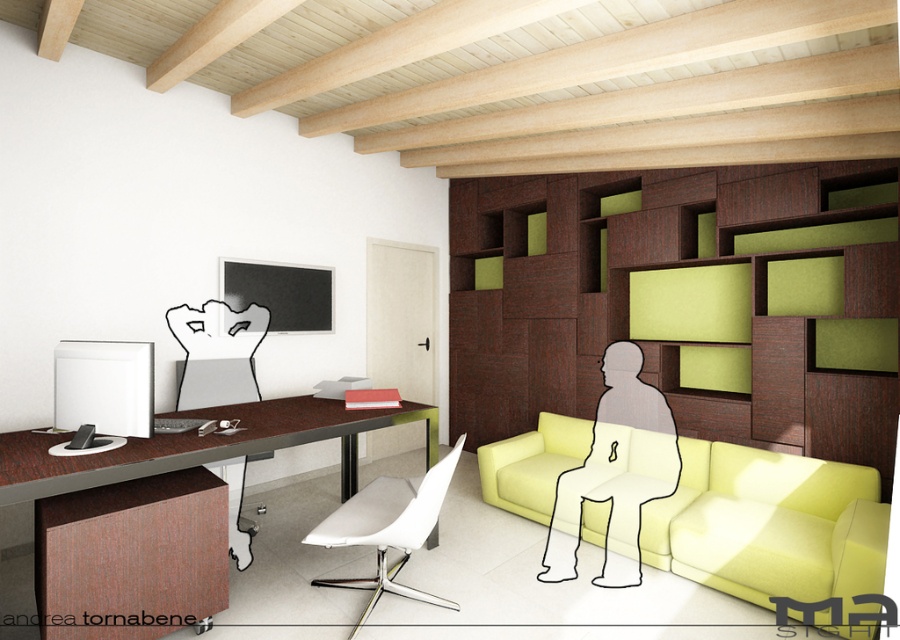
What do you see at coordinates (204, 445) in the screenshot? Image resolution: width=900 pixels, height=640 pixels. I see `brown wood desk at left` at bounding box center [204, 445].

Measure the distance from brown wood desk at left to white matte chair at center.

22.44 inches

Where is `brown wood desk at left`? brown wood desk at left is located at coordinates (204, 445).

Can you confirm if matte yellow couch at center is positioned below brown wood desk at left?

Yes, matte yellow couch at center is below brown wood desk at left.

Between matte yellow couch at center and brown wood desk at left, which one is positioned higher?

brown wood desk at left is above.

Is point (486, 493) positioned behind point (363, 420)?

Yes, point (486, 493) is behind point (363, 420).

Image resolution: width=900 pixels, height=640 pixels. I want to click on matte yellow couch at center, so click(x=770, y=525).

Is matte yellow couch at center wider than white matte chair at center?

Indeed, matte yellow couch at center has a greater width compared to white matte chair at center.

Locate an element on the screen. The width and height of the screenshot is (900, 640). matte yellow couch at center is located at coordinates (770, 525).